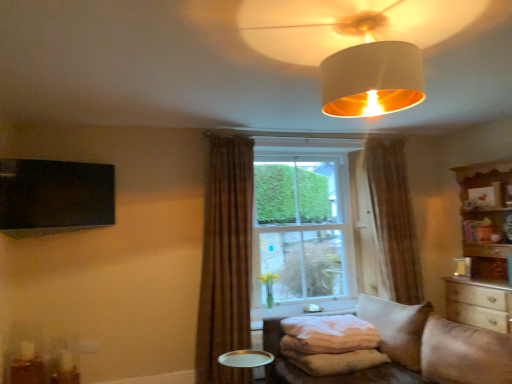
Question: Is metallic silver tray at lower center smaller than white soft pillow at lower center?

Choices:
 (A) no
 (B) yes

Answer: (B)

Question: From the image's perspective, would you say metallic silver tray at lower center is positioned over white soft pillow at lower center?

Choices:
 (A) no
 (B) yes

Answer: (A)

Question: Is metallic silver tray at lower center outside of white soft pillow at lower center?

Choices:
 (A) yes
 (B) no

Answer: (A)

Question: Is metallic silver tray at lower center to the left of white soft pillow at lower center from the viewer's perspective?

Choices:
 (A) no
 (B) yes

Answer: (B)

Question: Is metallic silver tray at lower center placed right next to white soft pillow at lower center?

Choices:
 (A) yes
 (B) no

Answer: (B)

Question: Would you say metallic silver tray at lower center is inside or outside brown sheer curtain at center, placed as the 1th curtain when sorted from back to front?

Choices:
 (A) outside
 (B) inside

Answer: (A)

Question: Is metallic silver tray at lower center to the left or to the right of brown sheer curtain at center, which is counted as the second curtain, starting from the front, in the image?

Choices:
 (A) left
 (B) right

Answer: (A)

Question: In terms of width, does metallic silver tray at lower center look wider or thinner when compared to brown sheer curtain at center, which is counted as the second curtain, starting from the front?

Choices:
 (A) thin
 (B) wide

Answer: (B)

Question: Is point (251, 362) positioned closer to the camera than point (396, 218)?

Choices:
 (A) closer
 (B) farther

Answer: (A)

Question: Is beige fabric studio couch at lower right inside or outside of white fabric lampshade at upper center?

Choices:
 (A) outside
 (B) inside

Answer: (A)

Question: Looking at the image, does beige fabric studio couch at lower right seem bigger or smaller compared to white fabric lampshade at upper center?

Choices:
 (A) big
 (B) small

Answer: (A)

Question: From a real-world perspective, relative to white fabric lampshade at upper center, is beige fabric studio couch at lower right vertically above or below?

Choices:
 (A) above
 (B) below

Answer: (B)

Question: In terms of width, does beige fabric studio couch at lower right look wider or thinner when compared to white fabric lampshade at upper center?

Choices:
 (A) thin
 (B) wide

Answer: (B)

Question: From a real-world perspective, is white fabric lampshade at upper center above or below white soft pillow at lower center?

Choices:
 (A) below
 (B) above

Answer: (B)

Question: Is white fabric lampshade at upper center situated inside white soft pillow at lower center or outside?

Choices:
 (A) inside
 (B) outside

Answer: (B)